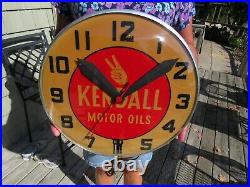
What are the coordinates of `clock hand` in the screenshot? It's located at click(x=125, y=91), click(x=145, y=83), click(x=97, y=81), click(x=95, y=122).